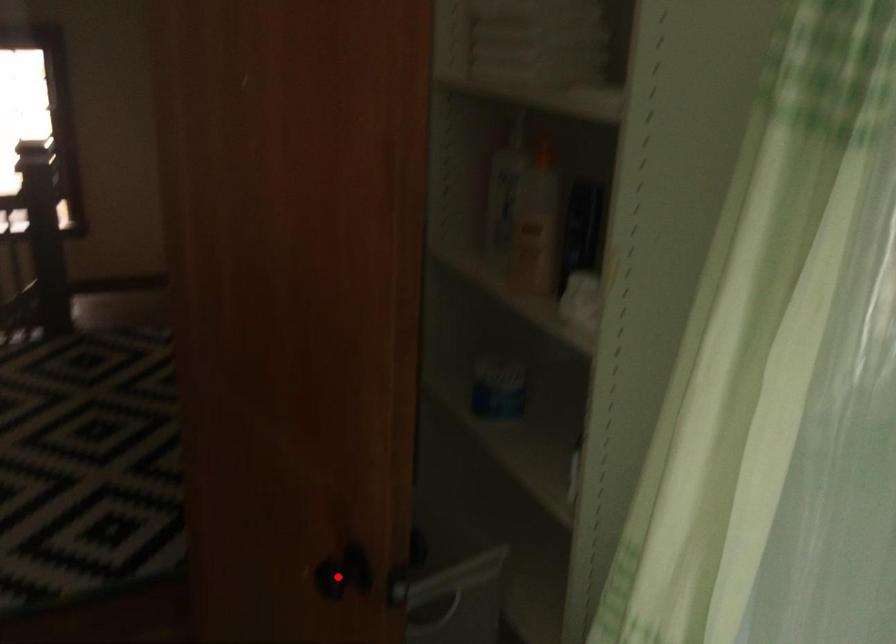
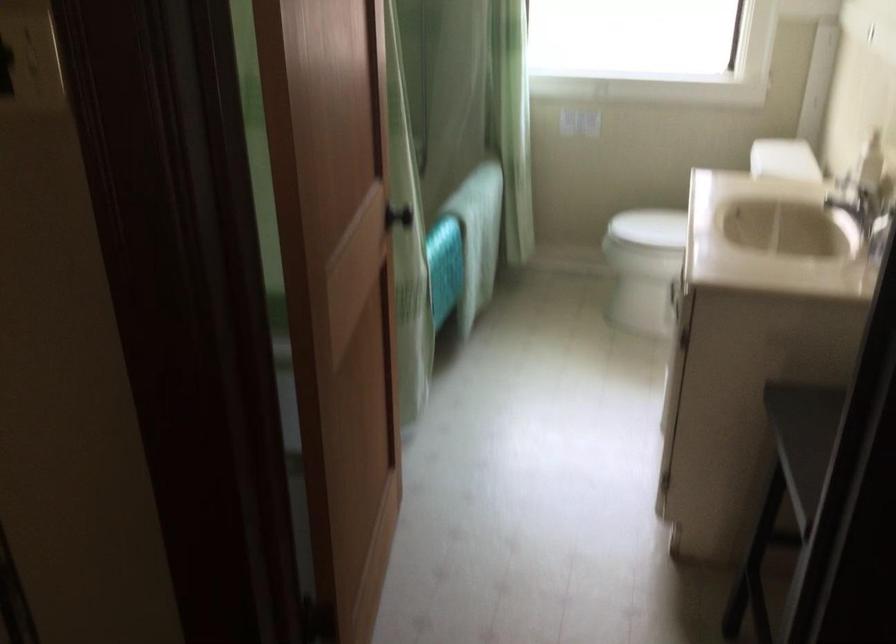
Question: I am providing you with two images of the same scene from different viewpoints. A red point is marked on the first image. Is the red point's position out of view in image 2?

Choices:
 (A) Yes
 (B) No

Answer: (A)